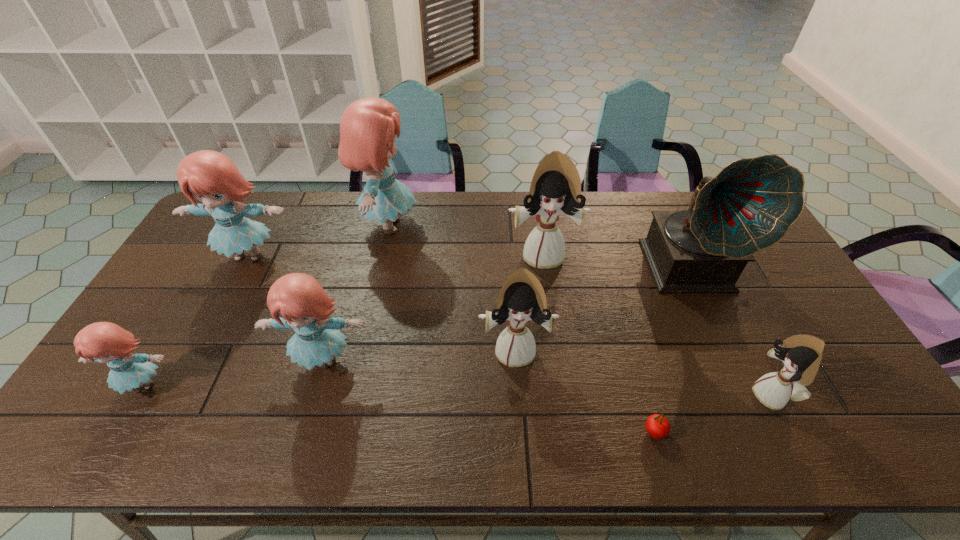
Where is `vacant region located on the front-facing side of the smallest blue doll`? vacant region located on the front-facing side of the smallest blue doll is located at coordinates pyautogui.click(x=118, y=428).

Locate an element on the screen. The height and width of the screenshot is (540, 960). free space located 0.250m on the back of the third object from right to left is located at coordinates (625, 336).

Where is `object that is at the far edge`? Image resolution: width=960 pixels, height=540 pixels. object that is at the far edge is located at coordinates (368, 127).

Find the location of a particular element. The height and width of the screenshot is (540, 960). doll that is at the near edge is located at coordinates (801, 354).

You are a GUI agent. You are given a task and a screenshot of the screen. Output one action in this format:
    pyautogui.click(x=<x>, y=<y>)
    Task: Click on the cherry that is at the near edge
    
    Given the screenshot: What is the action you would take?
    pyautogui.click(x=657, y=426)

Locate an element on the screen. object that is at the right edge is located at coordinates (750, 205).

You are a GUI agent. You are given a task and a screenshot of the screen. Output one action in this format:
    pyautogui.click(x=<x>, y=<y>)
    Task: Click on the vacant space at the far edge of the desktop
    Image resolution: width=960 pixels, height=540 pixels.
    Given the screenshot: What is the action you would take?
    pyautogui.click(x=503, y=221)

In the image, there is a desktop. At what (x,y) coordinates should I click in order to perform the action: click on vacant space at the near edge. Please return your answer as a coordinate pair (x, y). Looking at the image, I should click on (507, 438).

In the image, there is a desktop. Where is `vacant space at the right edge`? vacant space at the right edge is located at coordinates (793, 336).

This screenshot has width=960, height=540. Identify the location of blank region between the rightmost doll and the biggest black doll. (658, 326).